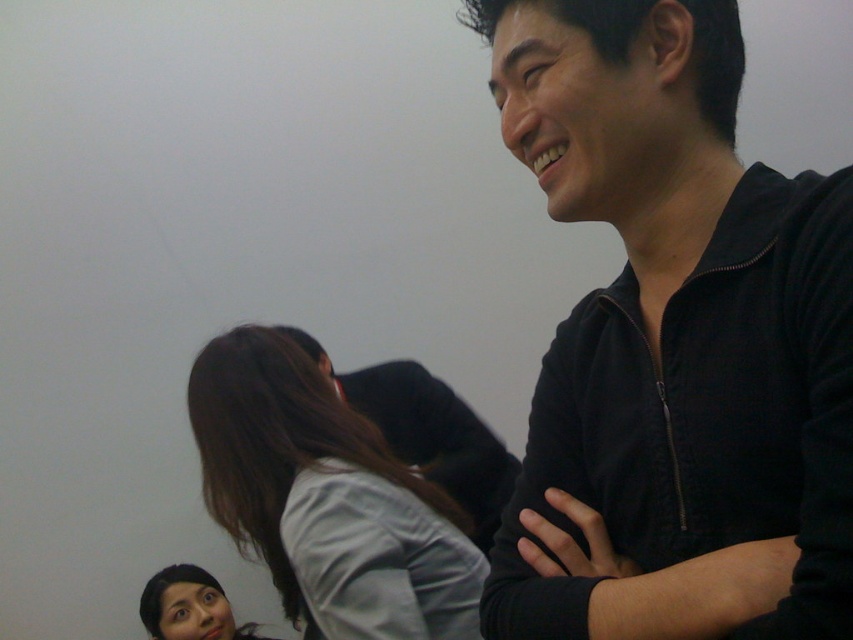
Who is positioned more to the left, gray fabric shirt at center or smooth skin face at lower left?

From the viewer's perspective, smooth skin face at lower left appears more on the left side.

Does gray fabric shirt at center come behind smooth skin face at lower left?

No, it is in front of smooth skin face at lower left.

Between point (264, 515) and point (213, 586), which one is positioned in front?

Point (264, 515)

At what (x,y) coordinates should I click in order to perform the action: click on gray fabric shirt at center. Please return your answer as a coordinate pair (x, y). Looking at the image, I should click on (326, 499).

Does black zip-up jacket at upper right have a lesser width compared to smooth skin face at lower left?

Correct, black zip-up jacket at upper right's width is less than smooth skin face at lower left's.

Between black zip-up jacket at upper right and smooth skin face at lower left, which one is positioned lower?

Positioned lower is smooth skin face at lower left.

Is point (706, 282) farther from camera compared to point (213, 609)?

No, it is in front of (213, 609).

The height and width of the screenshot is (640, 853). Find the location of `black zip-up jacket at upper right`. black zip-up jacket at upper right is located at coordinates (674, 344).

Is black zip-up jacket at upper right shorter than black matte jacket at upper right?

No.

Is black zip-up jacket at upper right closer to camera compared to black matte jacket at upper right?

Yes.

Find the location of `black zip-up jacket at upper right`. black zip-up jacket at upper right is located at coordinates (674, 344).

Where is `black zip-up jacket at upper right`? black zip-up jacket at upper right is located at coordinates (674, 344).